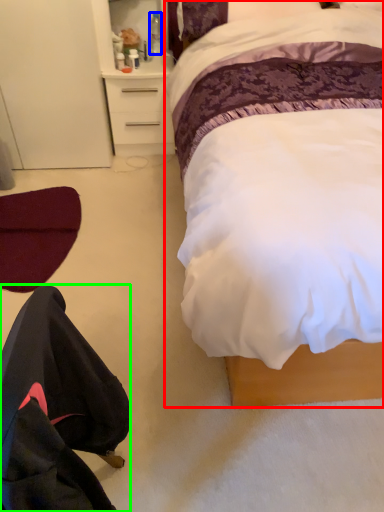
Question: Considering the real-world distances, which object is closest to bed (highlighted by a red box)? bottle (highlighted by a blue box) or robe (highlighted by a green box).

Choices:
 (A) bottle
 (B) robe

Answer: (B)